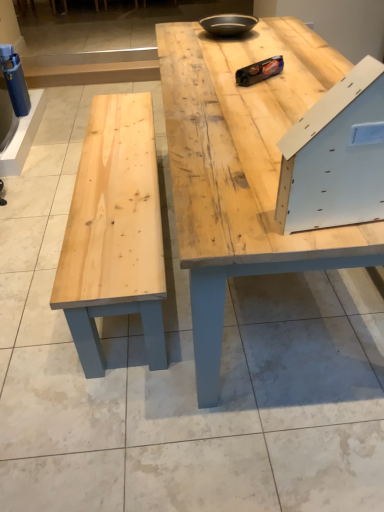
Where is `vacant area that is in front of white matte drawer at upper right`? vacant area that is in front of white matte drawer at upper right is located at coordinates (342, 236).